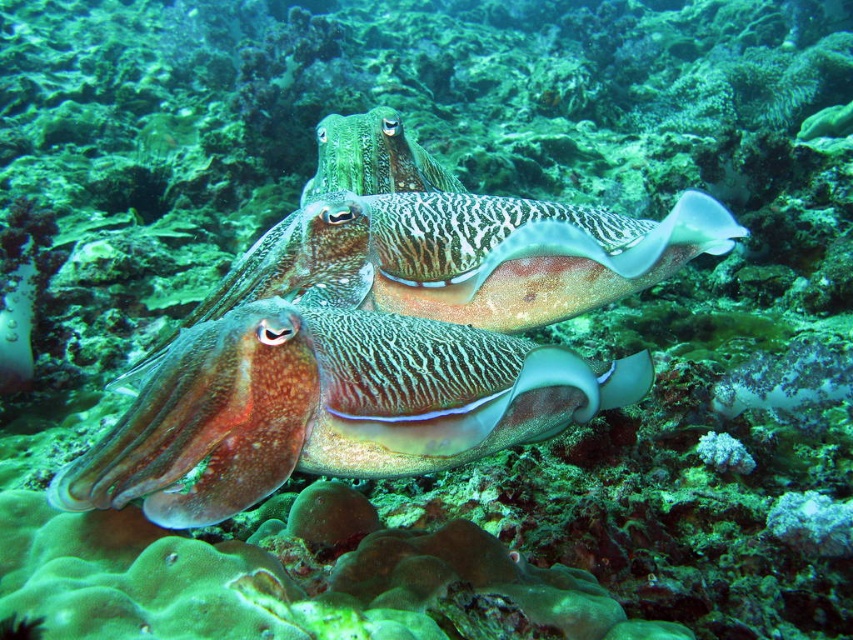
In the scene shown: Between smooth brown squid at center and green textured squid at center, which one has more height?

With more height is green textured squid at center.

Which of these two, smooth brown squid at center or green textured squid at center, stands shorter?

smooth brown squid at center

This screenshot has height=640, width=853. In order to click on smooth brown squid at center in this screenshot , I will do `click(329, 406)`.